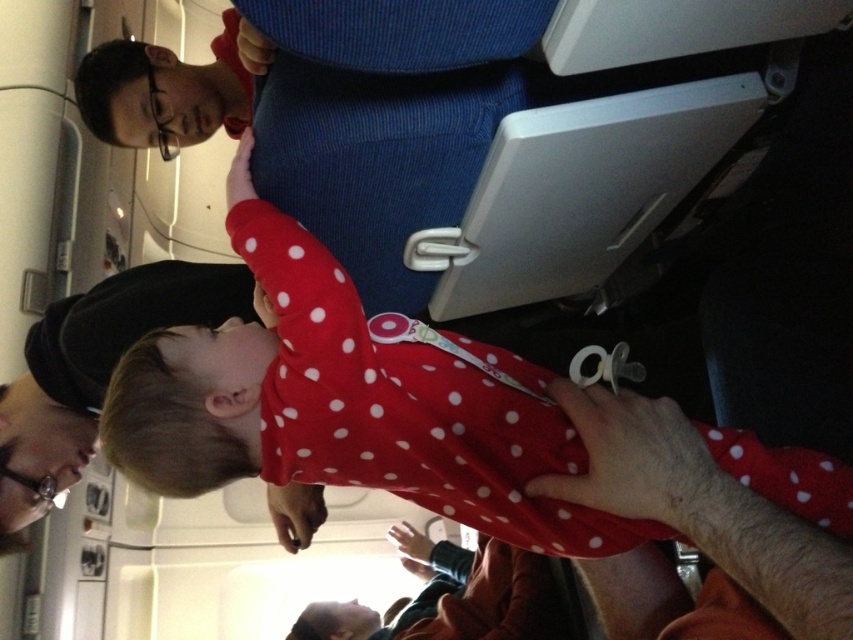
You are sitting in the airplane cabin and notice two points marked in the scene. Which point, point (144, 362) or point (236, 58), is nearer to you?

Point (144, 362) is closer to the viewer than point (236, 58), so the point (144, 362) is nearer to you.

You are a flight attendant in the airplane cabin. You need to ensure that all passengers are seated comfortably. Looking at the red polka dot onesie at center and the matte blue uniform at upper center, which object is wider?

The red polka dot onesie at center is wider than the matte blue uniform at upper center.